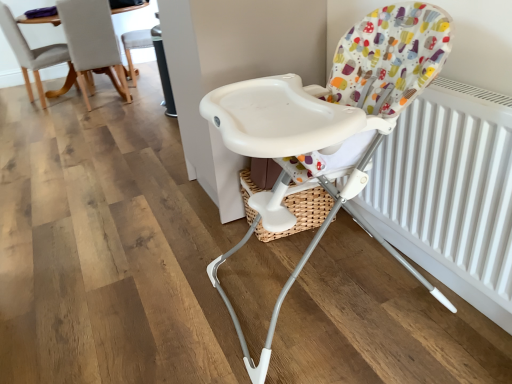
What do you see at coordinates (135, 48) in the screenshot?
I see `white plastic chair at upper center, which is the 2th chair from left to right` at bounding box center [135, 48].

Where is `white plastic chair at upper center, the first chair viewed from the back`? The width and height of the screenshot is (512, 384). white plastic chair at upper center, the first chair viewed from the back is located at coordinates (135, 48).

Which object is positioned more to the left, light gray fabric chair at upper left, placed as the 1th chair when sorted from left to right, or white matte radiator at right?

light gray fabric chair at upper left, placed as the 1th chair when sorted from left to right, is more to the left.

Which of these two, light gray fabric chair at upper left, placed as the 1th chair when sorted from left to right, or white matte radiator at right, is wider?

Wider between the two is light gray fabric chair at upper left, placed as the 1th chair when sorted from left to right.

Which is behind, white matte radiator at right or white plastic chair at upper center, the first chair viewed from the back?

white plastic chair at upper center, the first chair viewed from the back, is further from the camera.

From the image's perspective, which is below, white matte radiator at right or white plastic chair at upper center, which is the 2th chair from left to right?

From the image's view, white matte radiator at right is below.

Which is correct: white matte radiator at right is inside white plastic chair at upper center, which ranks as the 2th chair in right-to-left order, or outside of it?

white matte radiator at right cannot be found inside white plastic chair at upper center, which ranks as the 2th chair in right-to-left order.

Is white matte radiator at right wider or thinner than white plastic chair at upper center, which ranks as the 2th chair in right-to-left order?

Considering their sizes, white matte radiator at right looks slimmer than white plastic chair at upper center, which ranks as the 2th chair in right-to-left order.

Based on their positions, is white plastic chair at upper center, which ranks as the 2th chair in right-to-left order, located to the left or right of white matte radiator at right?

Based on their positions, white plastic chair at upper center, which ranks as the 2th chair in right-to-left order, is located to the left of white matte radiator at right.

Is white plastic chair at upper center, which ranks as the 2th chair in right-to-left order, taller or shorter than white matte radiator at right?

Considering their sizes, white plastic chair at upper center, which ranks as the 2th chair in right-to-left order, has more height than white matte radiator at right.

Do you think white plastic chair at upper center, the first chair viewed from the back, is within white matte radiator at right, or outside of it?

white plastic chair at upper center, the first chair viewed from the back, is not enclosed by white matte radiator at right.

From a real-world perspective, relative to white matte radiator at right, is white plastic chair at upper center, which is the 2th chair from left to right, vertically above or below?

From a real-world perspective, white plastic chair at upper center, which is the 2th chair from left to right, is physically below white matte radiator at right.

Is white matte radiator at right to the right of white plastic highchair at center, the 1th chair viewed from the right, from the viewer's perspective?

Answer: Correct, you'll find white matte radiator at right to the right of white plastic highchair at center, the 1th chair viewed from the right.

From the image's perspective, is white matte radiator at right beneath white plastic highchair at center, which is the 1th chair in front-to-back order?

Actually, white matte radiator at right appears above white plastic highchair at center, which is the 1th chair in front-to-back order, in the image.

Is white plastic highchair at center, the 3th chair when ordered from left to right, at the back of white matte radiator at right?

Yes, white plastic highchair at center, the 3th chair when ordered from left to right, is at the back of white matte radiator at right.

From a real-world perspective, between white plastic highchair at center, which is counted as the third chair, starting from the back, and white plastic chair at upper center, which is the 2th chair from left to right, who is vertically higher?

In real-world perspective, white plastic highchair at center, which is counted as the third chair, starting from the back, is above.

Which object is more forward, white plastic highchair at center, which is counted as the third chair, starting from the back, or white plastic chair at upper center, which appears as the third chair when viewed from the front?

white plastic highchair at center, which is counted as the third chair, starting from the back.

Considering the relative sizes of white plastic highchair at center, the 3th chair when ordered from left to right, and white plastic chair at upper center, which ranks as the 2th chair in right-to-left order, in the image provided, is white plastic highchair at center, the 3th chair when ordered from left to right, wider than white plastic chair at upper center, which ranks as the 2th chair in right-to-left order,?

Indeed, white plastic highchair at center, the 3th chair when ordered from left to right, has a greater width compared to white plastic chair at upper center, which ranks as the 2th chair in right-to-left order.

From the image's perspective, is white plastic highchair at center, the 3th chair when ordered from left to right, below white plastic chair at upper center, which is the 2th chair from left to right?

Correct, white plastic highchair at center, the 3th chair when ordered from left to right, appears lower than white plastic chair at upper center, which is the 2th chair from left to right, in the image.

Is the depth of light gray fabric chair at upper left, the 2th chair positioned from the front, greater than that of white plastic chair at upper center, which is the 2th chair from left to right?

That is False.

From a real-world perspective, does light gray fabric chair at upper left, placed as the 1th chair when sorted from left to right, stand above white plastic chair at upper center, which appears as the third chair when viewed from the front?

Indeed, from a real-world perspective, light gray fabric chair at upper left, placed as the 1th chair when sorted from left to right, stands above white plastic chair at upper center, which appears as the third chair when viewed from the front.

How many degrees apart are the facing directions of light gray fabric chair at upper left, placed as the 1th chair when sorted from left to right, and white plastic chair at upper center, which ranks as the 2th chair in right-to-left order?

There is a 161-degree angle between the facing directions of light gray fabric chair at upper left, placed as the 1th chair when sorted from left to right, and white plastic chair at upper center, which ranks as the 2th chair in right-to-left order.

From the image's perspective, is white matte radiator at right under light gray fabric chair at upper left, the 2th chair positioned from the front?

Yes, from the image's perspective, white matte radiator at right is below light gray fabric chair at upper left, the 2th chair positioned from the front.

Is white matte radiator at right at the left side of light gray fabric chair at upper left, the 3th chair in the right-to-left sequence?

No, white matte radiator at right is not to the left of light gray fabric chair at upper left, the 3th chair in the right-to-left sequence.

Is white matte radiator at right oriented towards light gray fabric chair at upper left, the 3th chair in the right-to-left sequence?

No.

Between point (456, 120) and point (16, 51), which one is positioned in front?

Point (456, 120)

Locate an element on the screen. The height and width of the screenshot is (384, 512). radiator lying on the right of light gray fabric chair at upper left, which appears as the 2th chair when viewed from the back is located at coordinates (451, 189).

At what (x,y) coordinates should I click in order to perform the action: click on radiator below the white plastic chair at upper center, which appears as the third chair when viewed from the front (from the image's perspective). Please return your answer as a coordinate pair (x, y). The height and width of the screenshot is (384, 512). Looking at the image, I should click on (451, 189).

Which object lies further to the anchor point white plastic highchair at center, the 1th chair viewed from the right, white matte radiator at right or light gray fabric chair at upper left, placed as the 1th chair when sorted from left to right?

light gray fabric chair at upper left, placed as the 1th chair when sorted from left to right, is positioned further to the anchor white plastic highchair at center, the 1th chair viewed from the right.

Based on their spatial positions, is light gray fabric chair at upper left, the 2th chair positioned from the front, or white plastic chair at upper center, which ranks as the 2th chair in right-to-left order, closer to white matte radiator at right?

Based on the image, white plastic chair at upper center, which ranks as the 2th chair in right-to-left order, appears to be nearer to white matte radiator at right.

When comparing their distances from white matte radiator at right, does white plastic chair at upper center, which ranks as the 2th chair in right-to-left order, or white plastic highchair at center, the 3th chair when ordered from left to right, seem closer?

white plastic highchair at center, the 3th chair when ordered from left to right, is positioned closer to the anchor white matte radiator at right.

When comparing their distances from white matte radiator at right, does light gray fabric chair at upper left, placed as the 1th chair when sorted from left to right, or white plastic highchair at center, which is counted as the third chair, starting from the back, seem further?

light gray fabric chair at upper left, placed as the 1th chair when sorted from left to right, lies further to white matte radiator at right than the other object.

Based on their spatial positions, is white matte radiator at right or white plastic highchair at center, which is counted as the third chair, starting from the back, further from light gray fabric chair at upper left, the 2th chair positioned from the front?

white matte radiator at right is further to light gray fabric chair at upper left, the 2th chair positioned from the front.

From the image, which object appears to be farther from light gray fabric chair at upper left, the 2th chair positioned from the front, white plastic highchair at center, the 1th chair viewed from the right, or white plastic chair at upper center, which is the 2th chair from left to right?

white plastic highchair at center, the 1th chair viewed from the right, is further to light gray fabric chair at upper left, the 2th chair positioned from the front.

Which object lies nearer to the anchor point light gray fabric chair at upper left, the 3th chair in the right-to-left sequence, white plastic chair at upper center, which appears as the third chair when viewed from the front, or white matte radiator at right?

Based on the image, white plastic chair at upper center, which appears as the third chair when viewed from the front, appears to be nearer to light gray fabric chair at upper left, the 3th chair in the right-to-left sequence.

Considering their positions, is white plastic highchair at center, the 1th chair viewed from the right, positioned further to white plastic chair at upper center, which is the 2th chair from left to right, than white matte radiator at right?

Among the two, white matte radiator at right is located further to white plastic chair at upper center, which is the 2th chair from left to right.

You are a GUI agent. You are given a task and a screenshot of the screen. Output one action in this format:
    pyautogui.click(x=<x>, y=<y>)
    Task: Click on the radiator between white plastic highchair at center, the 3th chair when ordered from left to right, and light gray fabric chair at upper left, the 3th chair in the right-to-left sequence, along the z-axis
    Image resolution: width=512 pixels, height=384 pixels.
    Given the screenshot: What is the action you would take?
    pyautogui.click(x=451, y=189)

Locate an element on the screen. chair between white plastic highchair at center, the 3th chair when ordered from left to right, and white plastic chair at upper center, the first chair viewed from the back, in the front-back direction is located at coordinates (35, 56).

Identify the location of chair located between white matte radiator at right and white plastic chair at upper center, which ranks as the 2th chair in right-to-left order, in the depth direction. (35, 56).

Where is `radiator located between white plastic highchair at center, the 1th chair viewed from the right, and white plastic chair at upper center, the first chair viewed from the back, in the depth direction`? The width and height of the screenshot is (512, 384). radiator located between white plastic highchair at center, the 1th chair viewed from the right, and white plastic chair at upper center, the first chair viewed from the back, in the depth direction is located at coordinates (451, 189).